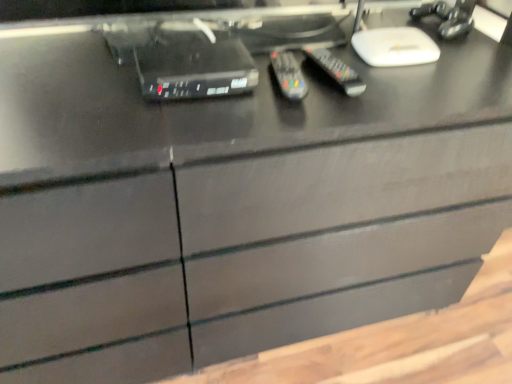
Where is `free space between black plastic device at upper center and black plastic remote at center, placed as the 1th control when sorted from left to right`? The image size is (512, 384). free space between black plastic device at upper center and black plastic remote at center, placed as the 1th control when sorted from left to right is located at coordinates (239, 97).